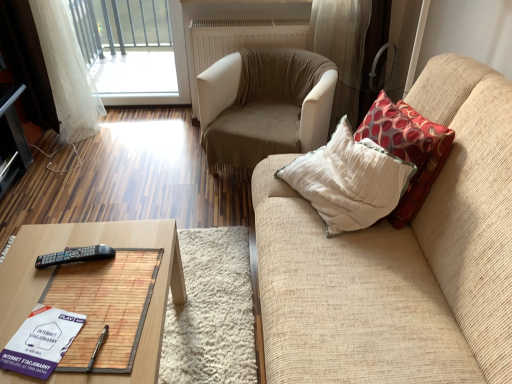
Where is `free space behind black plastic remote at lower left`? free space behind black plastic remote at lower left is located at coordinates (89, 236).